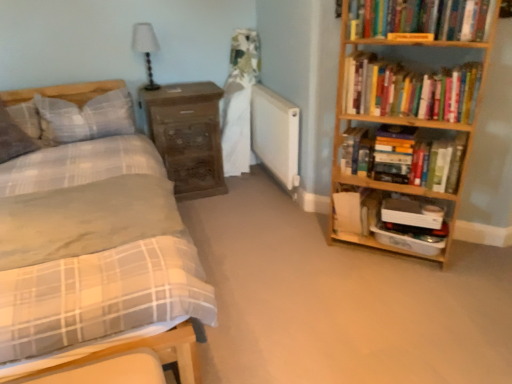
Where is `vacant area that is situated to the right of wooden carved chest of drawers at center`? The width and height of the screenshot is (512, 384). vacant area that is situated to the right of wooden carved chest of drawers at center is located at coordinates (245, 196).